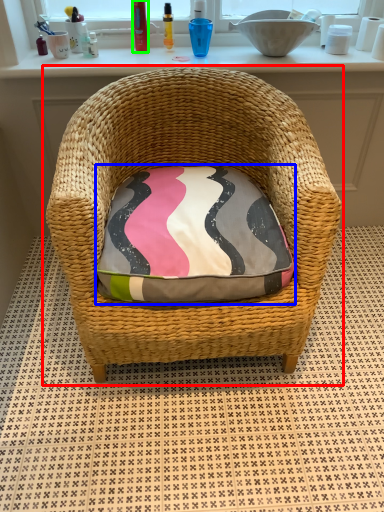
Question: Which object is the closest to the chair (highlighted by a red box)? Choose among these: throw pillow (highlighted by a blue box) or toiletry (highlighted by a green box).

Choices:
 (A) throw pillow
 (B) toiletry

Answer: (A)